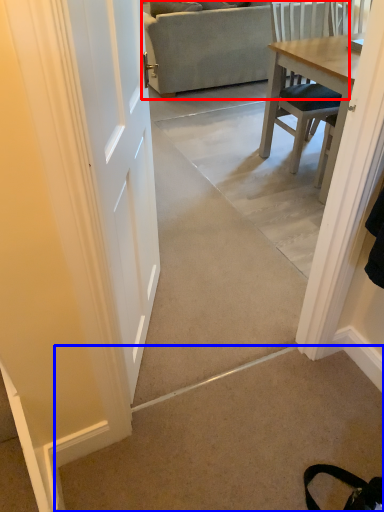
Question: Which object is closer to the camera taking this photo, studio couch (highlighted by a red box) or concrete (highlighted by a blue box)?

Choices:
 (A) studio couch
 (B) concrete

Answer: (B)